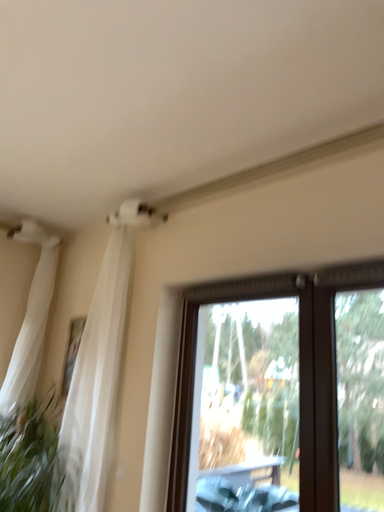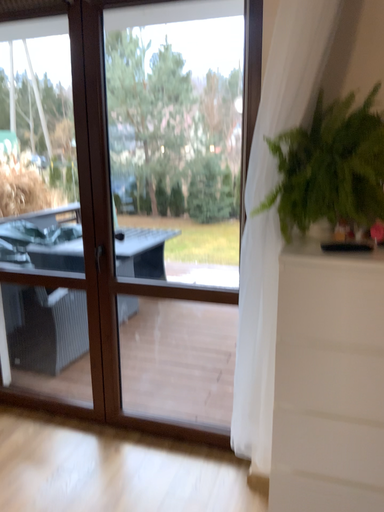
Question: How did the camera likely rotate when shooting the video?

Choices:
 (A) rotated left
 (B) rotated right

Answer: (B)